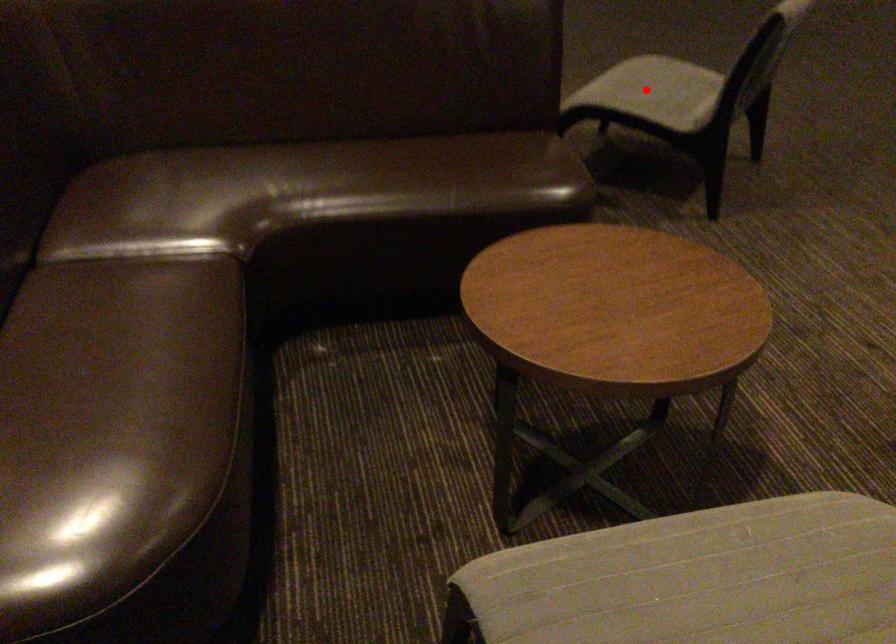
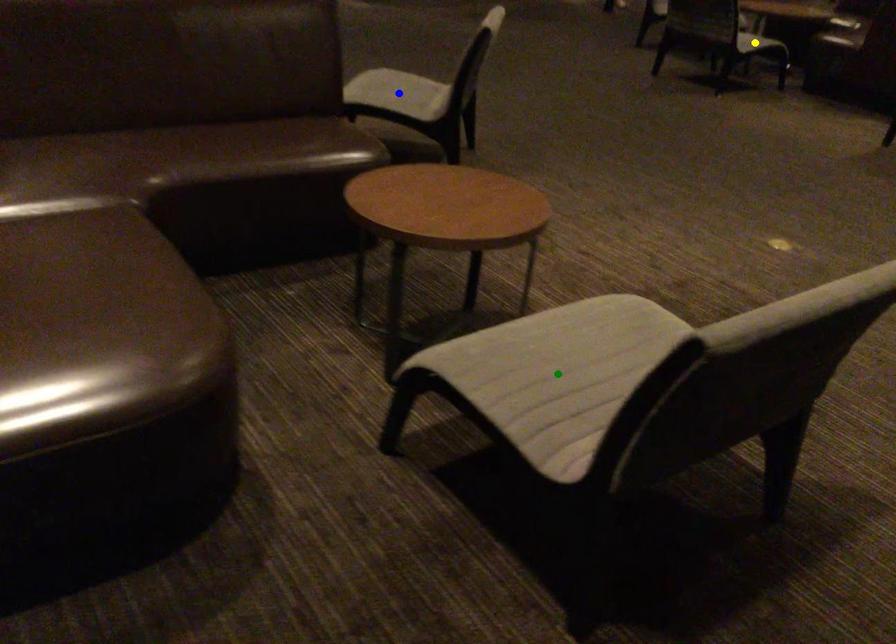
Question: I am providing you with two images of the same scene from different viewpoints. A red point is marked on the first image. You are given multiple points on the second image. Which point in image 2 represents the same 3d spot as the red point in image 1?

Choices:
 (A) yellow point
 (B) green point
 (C) blue point

Answer: (C)